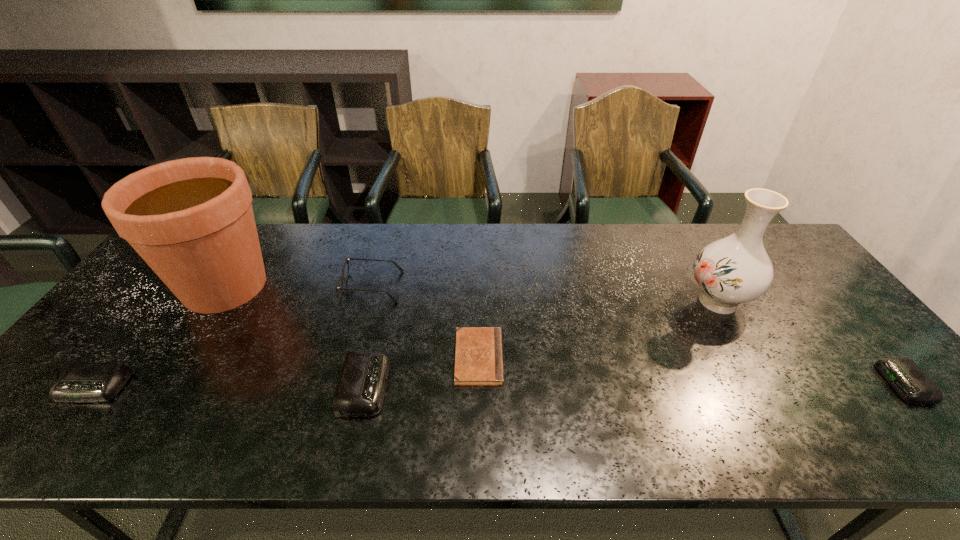
Where is `free area in between the fifth object from left to right and the third tallest object`? free area in between the fifth object from left to right and the third tallest object is located at coordinates (425, 322).

Locate which object ranks third in proximity to the second alarm clock from left to right. Please provide its 2D coordinates. Your answer should be formatted as a tuple, i.e. [(x, y)], where the tuple contains the x and y coordinates of a point satisfying the conditions above.

[(191, 220)]

Locate an element on the screen. object that stands as the fifth closest to the leftmost alarm clock is located at coordinates (734, 270).

Identify which alarm clock is the nearest to the sixth object from left to right. Please provide its 2D coordinates. Your answer should be formatted as a tuple, i.e. [(x, y)], where the tuple contains the x and y coordinates of a point satisfying the conditions above.

[(903, 374)]

Image resolution: width=960 pixels, height=540 pixels. In order to click on alarm clock that stands as the closest to the spectacles in this screenshot , I will do `click(360, 390)`.

The image size is (960, 540). In order to click on vacant space that satisfies the following two spatial constraints: 1. with the lenses facing outward on the fifth shortest object; 2. on the left side of the second object from right to left in this screenshot , I will do `click(369, 301)`.

Find the location of a particular element. The image size is (960, 540). free space in the image that satisfies the following two spatial constraints: 1. on the spine side of the fifth object from left to right; 2. on the display of the leftmost alarm clock is located at coordinates (479, 387).